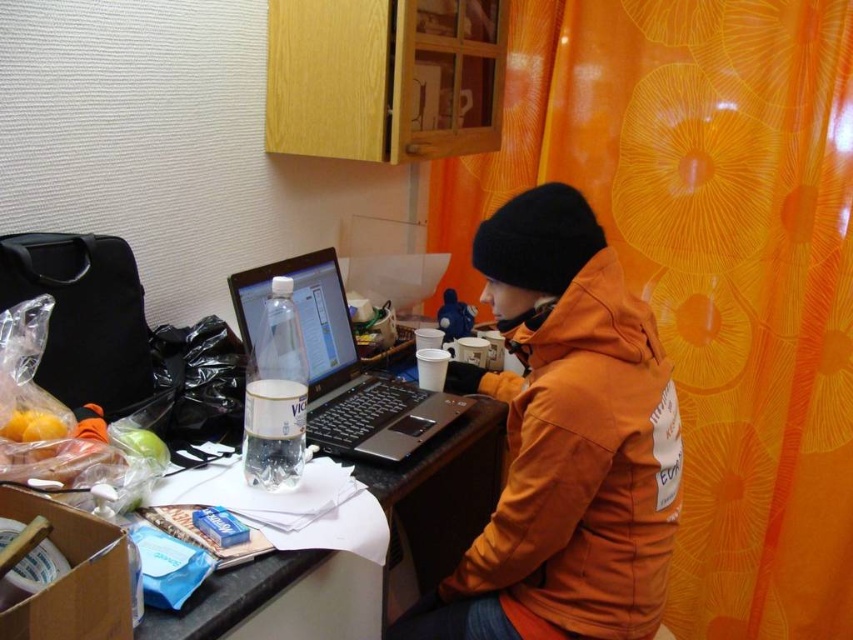
In the scene shown: You are standing in a home office and want to hang a picture frame on the wall where the orange floral curtain at upper right is located. The frame requires a nail placed exactly at the center of the curtain. Given that the wall is represented as a coordinate system from 0 to 1 in both x and y axes, what are the coordinates where you should hammer the nail?

The orange floral curtain at upper right is located at point (709, 266), so the nail should be placed at those coordinates to center the picture frame.

You are trying to reach the black plastic laptop at center from your current position. The orange puffy jacket at center is in your way. Can you move the jacket to access the laptop?

The orange puffy jacket at center is closer to the viewer than the black plastic laptop at center, so you would need to move the jacket to access the laptop.

From the picture: What is the spatial relationship between the orange floral curtain at upper right and the other objects in the scene?

The orange floral curtain at upper right is positioned at coordinates point [709,266], which places it near the upper right corner of the scene.